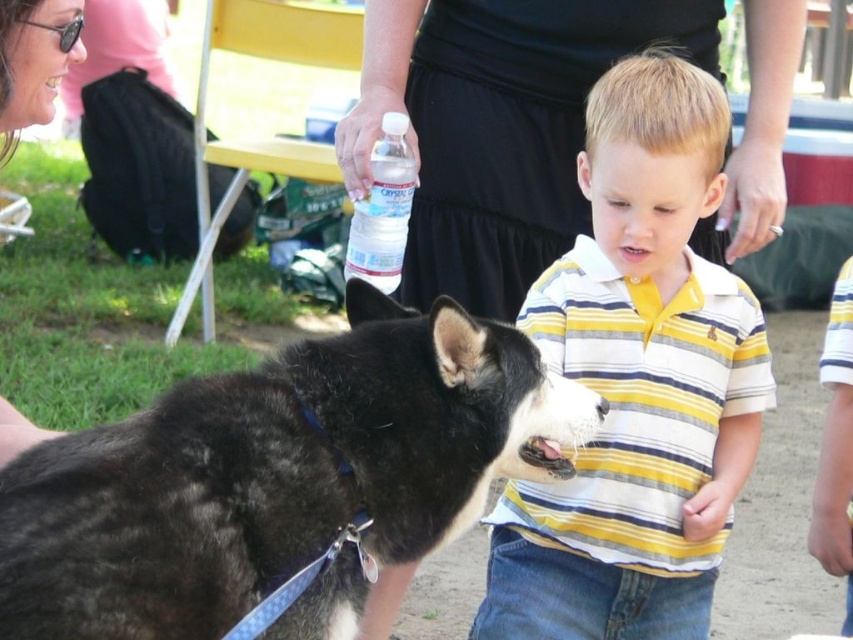
You are a photographer trying to capture a closeup of the black fur dog at center and the clear plastic water bottle at center. Since the camera can only focus on one object at a time, which object should you choose to ensure it fills the frame more effectively?

The black fur dog at center has a larger size compared to the clear plastic water bottle at center, so you should focus on the black fur dog at center to fill the frame more effectively.

You are a photographer trying to capture a closeup of the matte black nose at upper left while also including the black fur dog at center in the frame. Based on their positions, which direction should you move your camera to include both subjects?

The black fur dog at center is to the right of the matte black nose at upper left, so you should move your camera to the left to include both subjects.